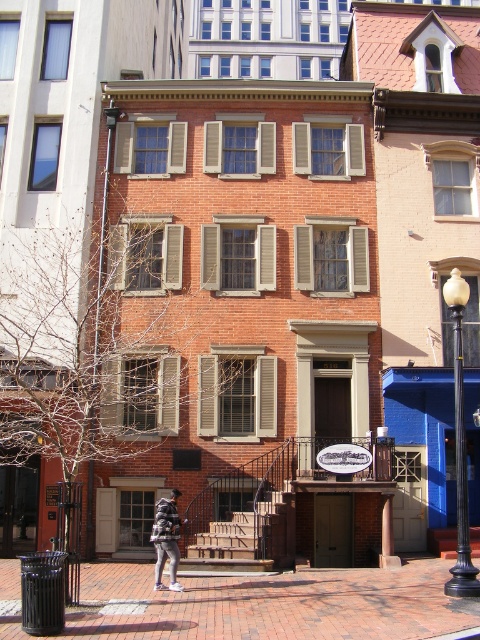
Does point (456, 387) come in front of point (164, 561)?

Yes, point (456, 387) is in front of point (164, 561).

Locate an element on the screen. The image size is (480, 640). white glossy lamp post at right is located at coordinates (459, 448).

Can you confirm if brick pavement at center is positioned to the left of white glossy lamp post at right?

Yes, brick pavement at center is to the left of white glossy lamp post at right.

In the scene shown: Does brick pavement at center come in front of white glossy lamp post at right?

Yes, it is in front of white glossy lamp post at right.

You are a GUI agent. You are given a task and a screenshot of the screen. Output one action in this format:
    pyautogui.click(x=<x>, y=<y>)
    Task: Click on the brick pavement at center
    
    Given the screenshot: What is the action you would take?
    pyautogui.click(x=269, y=604)

Can you confirm if brick pavement at center is shorter than striped sweater at center?

Incorrect, brick pavement at center's height does not fall short of striped sweater at center's.

Who is lower down, brick pavement at center or striped sweater at center?

brick pavement at center is below.

You are a GUI agent. You are given a task and a screenshot of the screen. Output one action in this format:
    pyautogui.click(x=<x>, y=<y>)
    Task: Click on the brick pavement at center
    This screenshot has height=640, width=480.
    Given the screenshot: What is the action you would take?
    pyautogui.click(x=269, y=604)

Find the location of a particular element. This screenshot has height=640, width=480. brick pavement at center is located at coordinates (269, 604).